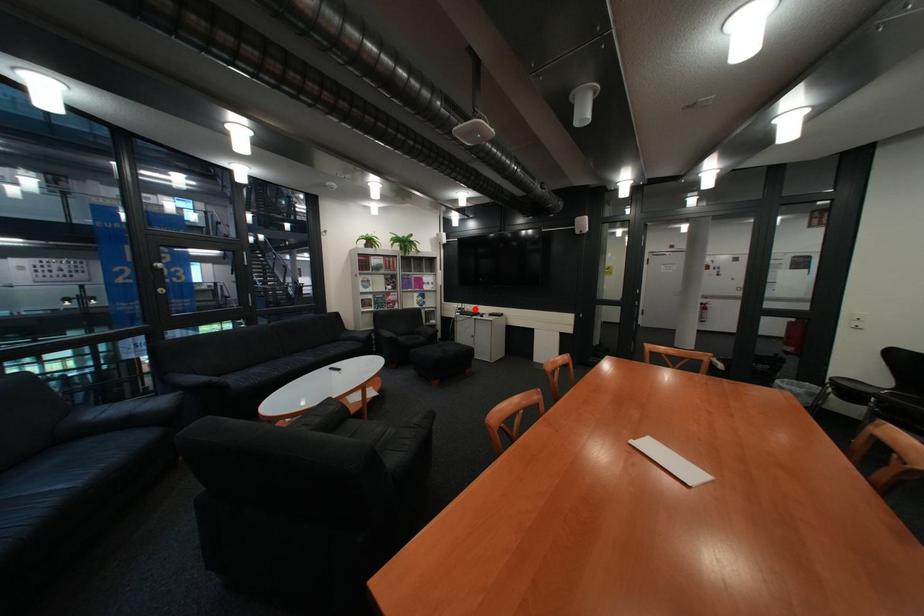
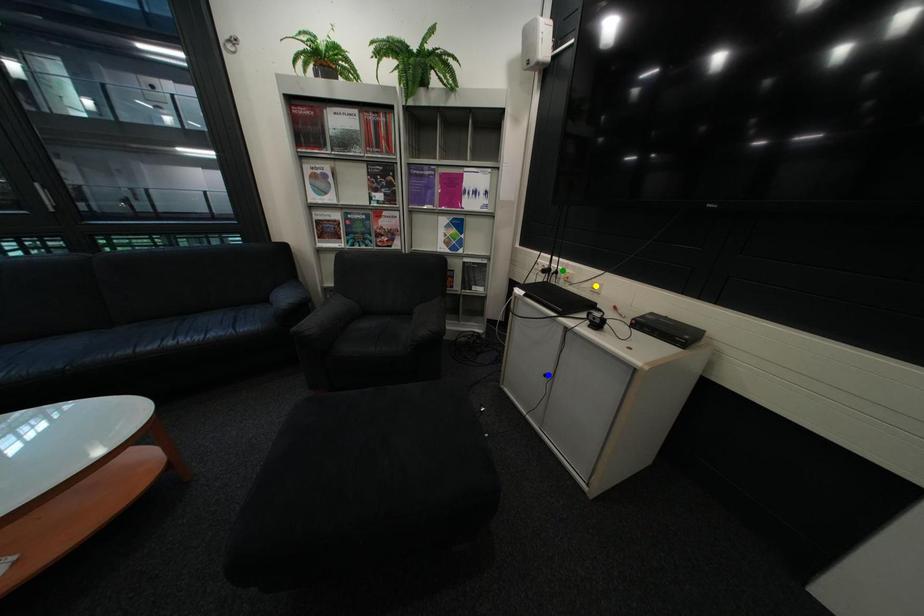
Question: I am providing you with two images of the same scene from different viewpoints. A red point is marked on the first image. You are given multiple points on the second image. Which point in image 2 is actually the same real-world point as the red point in image 1?

Choices:
 (A) blue point
 (B) green point
 (C) yellow point

Answer: (B)